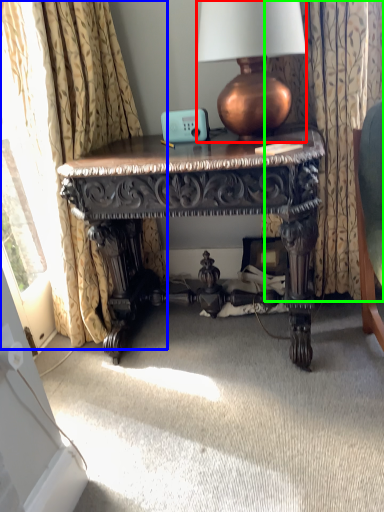
Question: Which is farther away from lamp (highlighted by a red box)? curtain (highlighted by a blue box) or curtain (highlighted by a green box)?

Choices:
 (A) curtain
 (B) curtain

Answer: (A)